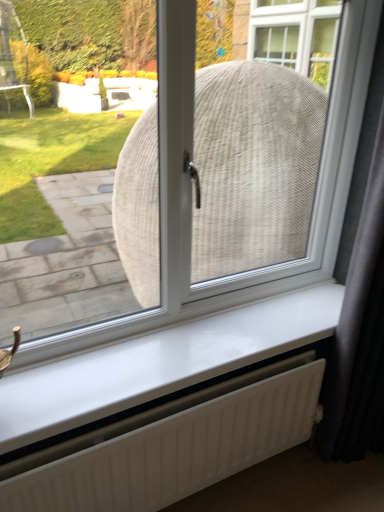
Image resolution: width=384 pixels, height=512 pixels. What are the coordinates of `free location above white glossy window sill at center (from a real-world perspective)` in the screenshot? It's located at (198, 340).